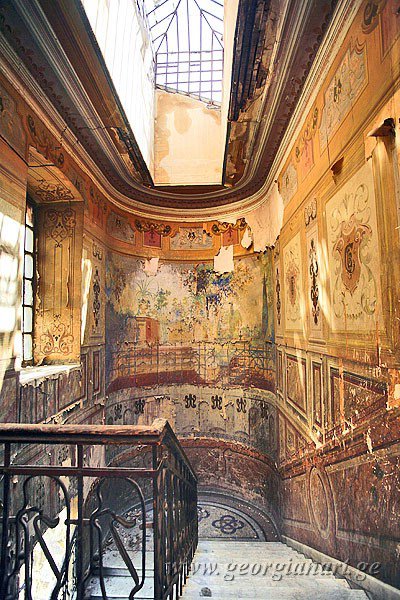
Locate an element on the screen. The image size is (400, 600). windowsill is located at coordinates (32, 373).